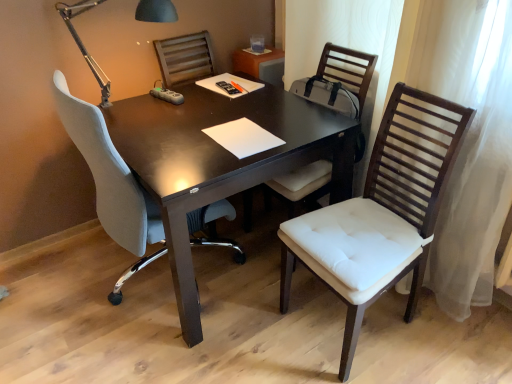
Describe the element at coordinates (344, 75) in the screenshot. This screenshot has width=512, height=384. I see `white padded chair at right, which is counted as the 2th chair, starting from the right` at that location.

The image size is (512, 384). I want to click on white fabric chair at left, which is the 1th chair from left to right, so click(111, 183).

This screenshot has height=384, width=512. Describe the element at coordinates (111, 183) in the screenshot. I see `white fabric chair at left, the 3th chair when ordered from right to left` at that location.

The width and height of the screenshot is (512, 384). Describe the element at coordinates (415, 156) in the screenshot. I see `white padded chair at right, which is the 1th chair in right-to-left order` at that location.

The height and width of the screenshot is (384, 512). What are the coordinates of `white paper at center` in the screenshot? It's located at (243, 137).

Find the location of a particular element. white padded chair at right, the 2th chair viewed from the left is located at coordinates (344, 75).

Considering the sizes of objects matte black table lamp at upper left and white padded chair at right, the 2th chair viewed from the left, in the image provided, who is smaller, matte black table lamp at upper left or white padded chair at right, the 2th chair viewed from the left,?

matte black table lamp at upper left is smaller.

Is point (140, 19) more distant than point (284, 182)?

That is True.

From a real-world perspective, who is located lower, matte black table lamp at upper left or white padded chair at right, which is counted as the 2th chair, starting from the right?

white padded chair at right, which is counted as the 2th chair, starting from the right, is physically lower.

From the image's perspective, relative to white padded chair at right, which is the 1th chair in right-to-left order, is matte black table lamp at upper left above or below?

Clearly, from the image's perspective, matte black table lamp at upper left is above white padded chair at right, which is the 1th chair in right-to-left order.

Can you confirm if matte black table lamp at upper left is smaller than white padded chair at right, which is the 1th chair in right-to-left order?

Indeed, matte black table lamp at upper left has a smaller size compared to white padded chair at right, which is the 1th chair in right-to-left order.

Is matte black table lamp at upper left situated inside white padded chair at right, the 3th chair from the left, or outside?

matte black table lamp at upper left is spatially situated outside white padded chair at right, the 3th chair from the left.

Is white padded chair at right, the 3th chair from the left, at the back of matte black table lamp at upper left?

No, matte black table lamp at upper left is not facing away from white padded chair at right, the 3th chair from the left.

Is matte black table lamp at upper left to the left or to the right of dark wood table at center in the image?

In the image, matte black table lamp at upper left appears on the left side of dark wood table at center.

Consider the image. From a real-world perspective, does matte black table lamp at upper left sit lower than dark wood table at center?

Incorrect, from a real-world perspective, matte black table lamp at upper left is higher than dark wood table at center.

Between matte black table lamp at upper left and dark wood table at center, which one is positioned in front?

dark wood table at center.

Between dark wood table at center and white padded chair at right, the 3th chair from the left, which one has larger size?

With larger size is dark wood table at center.

Between dark wood table at center and white padded chair at right, which is the 1th chair in right-to-left order, which one has smaller width?

white padded chair at right, which is the 1th chair in right-to-left order.

Considering the positions of points (167, 221) and (328, 277), is point (167, 221) closer to camera compared to point (328, 277)?

Yes, point (167, 221) is in front of point (328, 277).

Is dark wood table at center at the right side of white padded chair at right, the 2th chair viewed from the left?

No.

At what (x,y) coordinates should I click in order to perform the action: click on table lying below the white padded chair at right, the 2th chair viewed from the left (from the image's perspective). Please return your answer as a coordinate pair (x, y). Looking at the image, I should click on (220, 162).

Can you see dark wood table at center touching white padded chair at right, the 2th chair viewed from the left?

No.

Looking at the image, does white padded chair at right, the 3th chair from the left, seem bigger or smaller compared to white paper at center?

Considering their sizes, white padded chair at right, the 3th chair from the left, takes up more space than white paper at center.

From the image's perspective, is white padded chair at right, the 3th chair from the left, located above or below white paper at center?

white padded chair at right, the 3th chair from the left, is situated lower than white paper at center in the image.

Measure the distance between white padded chair at right, which is the 1th chair in right-to-left order, and white paper at center.

A distance of 20.26 inches exists between white padded chair at right, which is the 1th chair in right-to-left order, and white paper at center.

Considering the relative positions of white padded chair at right, which is the 1th chair in right-to-left order, and white paper at center in the image provided, is white padded chair at right, which is the 1th chair in right-to-left order, to the left or to the right of white paper at center?

white padded chair at right, which is the 1th chair in right-to-left order, is to the right of white paper at center.

Can you confirm if white padded chair at right, which is counted as the 2th chair, starting from the right, is thinner than dark wood table at center?

Correct, the width of white padded chair at right, which is counted as the 2th chair, starting from the right, is less than that of dark wood table at center.

Is white padded chair at right, the 2th chair viewed from the left, positioned far away from dark wood table at center?

No.

Is white padded chair at right, which is counted as the 2th chair, starting from the right, spatially inside dark wood table at center, or outside of it?

white padded chair at right, which is counted as the 2th chair, starting from the right, can be found inside dark wood table at center.

Find the location of a particular element. chair lying behind the matte black table lamp at upper left is located at coordinates (344, 75).

Identify the location of the 2nd chair in front of the matte black table lamp at upper left. Image resolution: width=512 pixels, height=384 pixels. (415, 156).

Based on the photo, considering their positions, is white padded chair at right, the 2th chair viewed from the left, positioned further to matte black table lamp at upper left than white padded chair at right, which is the 1th chair in right-to-left order?

white padded chair at right, which is the 1th chair in right-to-left order, is further to matte black table lamp at upper left.

Which object lies nearer to the anchor point white paper at center, white padded chair at right, which is counted as the 2th chair, starting from the right, or dark wood table at center?

dark wood table at center is positioned closer to the anchor white paper at center.

From the image, which object appears to be nearer to dark wood table at center, matte black table lamp at upper left or white padded chair at right, which is the 1th chair in right-to-left order?

Based on the image, white padded chair at right, which is the 1th chair in right-to-left order, appears to be nearer to dark wood table at center.

When comparing their distances from white padded chair at right, the 3th chair from the left, does white paper at center or matte black table lamp at upper left seem closer?

white paper at center lies closer to white padded chair at right, the 3th chair from the left, than the other object.

Looking at the image, which one is located closer to white fabric chair at left, the 3th chair when ordered from right to left, white padded chair at right, which is the 1th chair in right-to-left order, or white paper at center?

Based on the image, white paper at center appears to be nearer to white fabric chair at left, the 3th chair when ordered from right to left.

Based on the photo, considering their positions, is white fabric chair at left, the 3th chair when ordered from right to left, positioned closer to dark wood table at center than white padded chair at right, the 2th chair viewed from the left?

white fabric chair at left, the 3th chair when ordered from right to left, lies closer to dark wood table at center than the other object.

Estimate the real-world distances between objects in this image. Which object is closer to dark wood table at center, white paper at center or white padded chair at right, which is counted as the 2th chair, starting from the right?

white paper at center is closer to dark wood table at center.

Looking at the image, which one is located further to white paper at center, dark wood table at center or white fabric chair at left, which is the 1th chair from left to right?

white fabric chair at left, which is the 1th chair from left to right.

Find the location of a particular element. table between white fabric chair at left, the 3th chair when ordered from right to left, and white padded chair at right, which is counted as the 2th chair, starting from the right, from left to right is located at coordinates (220, 162).

Locate an element on the screen. This screenshot has height=384, width=512. chair between white fabric chair at left, which is the 1th chair from left to right, and white padded chair at right, which is the 1th chair in right-to-left order, in the horizontal direction is located at coordinates (344, 75).

The width and height of the screenshot is (512, 384). I want to click on notepad between matte black table lamp at upper left and white padded chair at right, which is counted as the 2th chair, starting from the right, in the horizontal direction, so click(x=243, y=137).

The height and width of the screenshot is (384, 512). I want to click on notepad between white padded chair at right, which is the 1th chair in right-to-left order, and white padded chair at right, which is counted as the 2th chair, starting from the right, from front to back, so [243, 137].